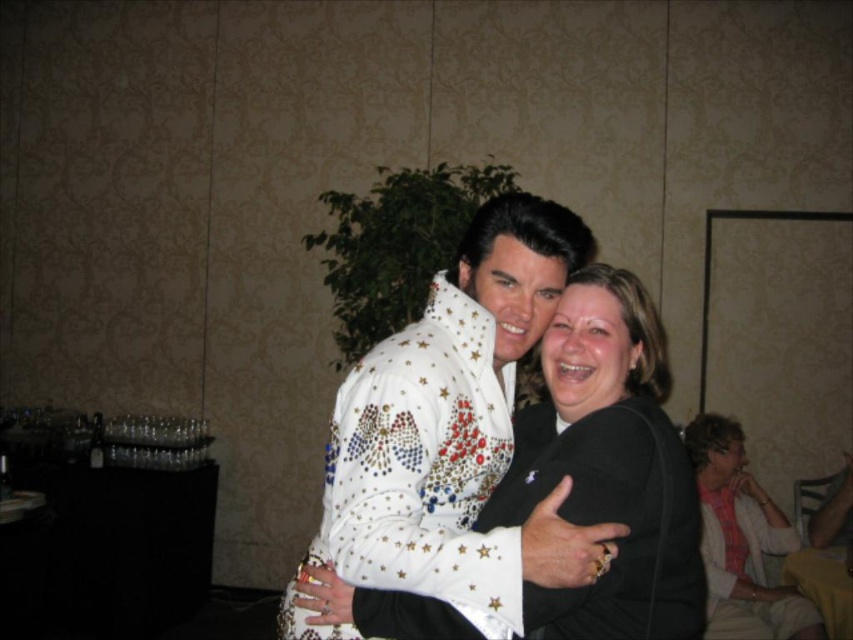
Question: Can you confirm if white sequined dress at center is thinner than plaid shirt at right?

Choices:
 (A) yes
 (B) no

Answer: (A)

Question: Estimate the real-world distances between objects in this image. Which object is closer to the white sequined jacket at center?

Choices:
 (A) white sequined dress at center
 (B) plaid shirt at right

Answer: (A)

Question: Does white sequined jacket at center appear over white sequined dress at center?

Choices:
 (A) no
 (B) yes

Answer: (A)

Question: Which point is farther to the camera?

Choices:
 (A) white sequined jacket at center
 (B) plaid shirt at right

Answer: (B)

Question: Among these points, which one is nearest to the camera?

Choices:
 (A) (718, 499)
 (B) (340, 529)
 (C) (552, 385)

Answer: (B)

Question: Does white sequined jacket at center have a smaller size compared to plaid shirt at right?

Choices:
 (A) yes
 (B) no

Answer: (A)